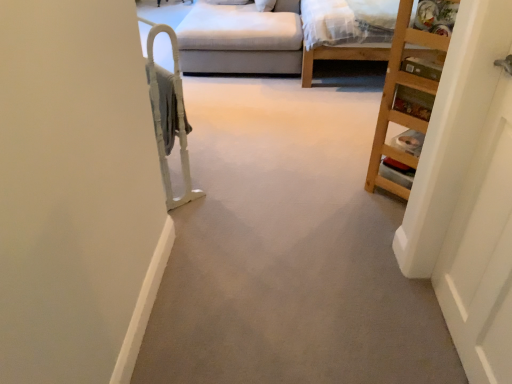
Question: Can you confirm if wooden bookshelf at right is thinner than white wooden door at right?

Choices:
 (A) yes
 (B) no

Answer: (B)

Question: Can you confirm if wooden bookshelf at right is positioned to the right of white wooden door at right?

Choices:
 (A) no
 (B) yes

Answer: (B)

Question: Is wooden bookshelf at right taller than white wooden door at right?

Choices:
 (A) yes
 (B) no

Answer: (B)

Question: Does wooden bookshelf at right have a lesser height compared to white wooden door at right?

Choices:
 (A) yes
 (B) no

Answer: (A)

Question: Can you confirm if wooden bookshelf at right is positioned to the left of white wooden door at right?

Choices:
 (A) no
 (B) yes

Answer: (A)

Question: Is wooden bookshelf at right in contact with white wooden door at right?

Choices:
 (A) no
 (B) yes

Answer: (A)

Question: Does wooden bed frame at upper right appear on the left side of white wooden door at right?

Choices:
 (A) no
 (B) yes

Answer: (A)

Question: Does wooden bed frame at upper right have a lesser height compared to white wooden door at right?

Choices:
 (A) yes
 (B) no

Answer: (A)

Question: Would you say wooden bed frame at upper right contains white wooden door at right?

Choices:
 (A) yes
 (B) no

Answer: (B)

Question: From the image's perspective, is wooden bed frame at upper right below white wooden door at right?

Choices:
 (A) yes
 (B) no

Answer: (B)

Question: Would you say wooden bed frame at upper right is outside white wooden door at right?

Choices:
 (A) no
 (B) yes

Answer: (B)

Question: From a real-world perspective, is wooden bed frame at upper right over white wooden door at right?

Choices:
 (A) no
 (B) yes

Answer: (A)

Question: Are white wooden door at right and white plastic bunk bed at left beside each other?

Choices:
 (A) no
 (B) yes

Answer: (A)